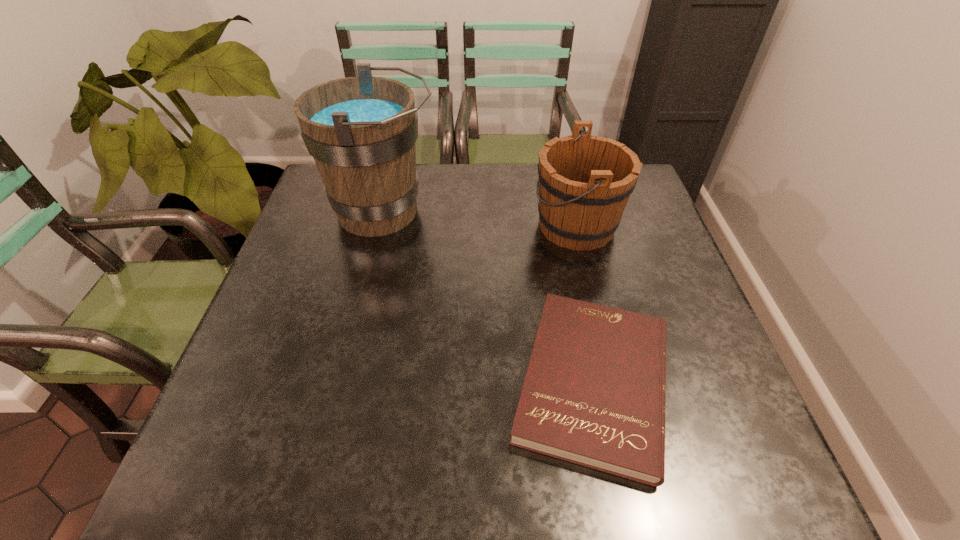
This screenshot has width=960, height=540. Identify the location of the taller wine bucket. (361, 131).

The image size is (960, 540). In order to click on the left wine bucket in this screenshot , I will do `click(361, 131)`.

What are the coordinates of `the right wine bucket` in the screenshot? It's located at (585, 181).

I want to click on the second shortest object, so click(x=585, y=181).

You are a GUI agent. You are given a task and a screenshot of the screen. Output one action in this format:
    pyautogui.click(x=<x>, y=<y>)
    Task: Click on the hardback book
    
    Given the screenshot: What is the action you would take?
    pyautogui.click(x=594, y=393)

The width and height of the screenshot is (960, 540). I want to click on the nearest object, so click(594, 393).

At what (x,y) coordinates should I click in order to perform the action: click on free location located with a handle on the side of the taller wine bucket. Please return your answer as a coordinate pair (x, y). Looking at the image, I should click on (559, 211).

Image resolution: width=960 pixels, height=540 pixels. I want to click on free location located 0.060m on the side of the right wine bucket with the handle for carrying, so click(x=511, y=226).

I want to click on vacant space located 0.100m on the side of the right wine bucket with the handle for carrying, so click(496, 226).

At what (x,y) coordinates should I click in order to perform the action: click on vacant space located 0.350m on the side of the right wine bucket with the handle for carrying. Please return your answer as a coordinate pair (x, y). Looking at the image, I should click on (406, 226).